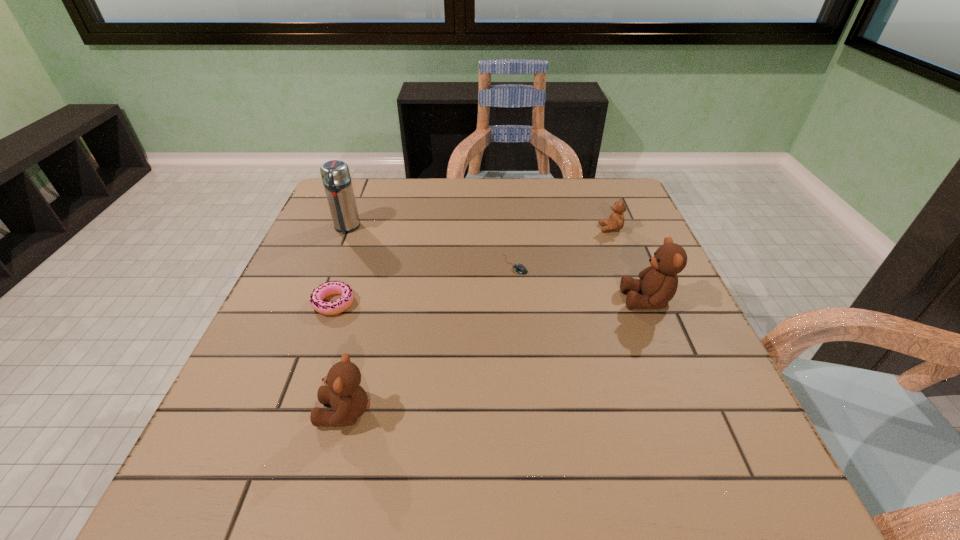
Find the location of a particular element. The width and height of the screenshot is (960, 540). vacant area situated 0.080m on the right of the doughnut is located at coordinates point(391,303).

Locate an element on the screen. The image size is (960, 540). free region located with a handle on the side of the thermos bottle is located at coordinates (322, 291).

Locate an element on the screen. The image size is (960, 540). teddy bear positioned at the far edge is located at coordinates (616, 220).

Locate an element on the screen. Image resolution: width=960 pixels, height=540 pixels. thermos bottle present at the far edge is located at coordinates (335, 174).

What are the coordinates of `object positioned at the near edge` in the screenshot? It's located at (349, 401).

Identify the location of doughnut present at the left edge. (328, 288).

What are the coordinates of `thermos bottle at the left edge` in the screenshot? It's located at (335, 174).

At what (x,y) coordinates should I click in order to perform the action: click on object that is at the far left corner. Please return your answer as a coordinate pair (x, y). Looking at the image, I should click on (335, 174).

You are a GUI agent. You are given a task and a screenshot of the screen. Output one action in this format:
    pyautogui.click(x=<x>, y=<y>)
    Task: Click on the object present at the far right corner
    The width and height of the screenshot is (960, 540).
    Given the screenshot: What is the action you would take?
    pyautogui.click(x=616, y=220)

The width and height of the screenshot is (960, 540). I want to click on vacant region at the far edge of the desktop, so click(x=528, y=220).